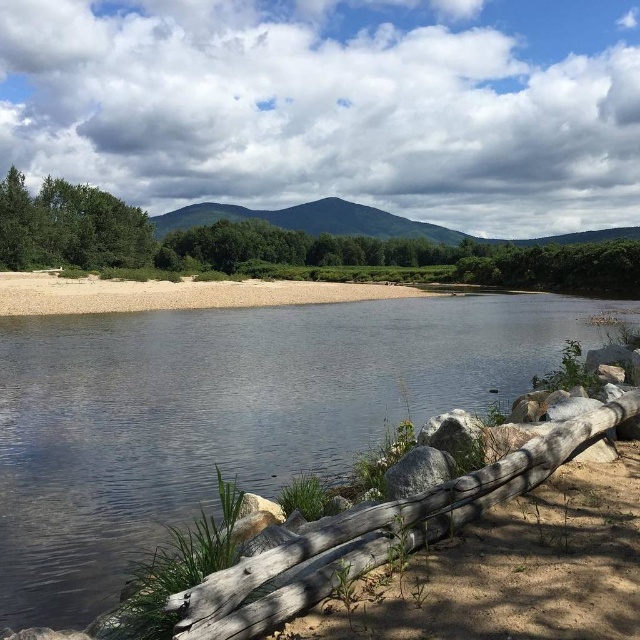
You are standing at the edge of the riverbank in the image and want to reach both the point at coordinates point (147, 376) and the point at coordinates point (504, 248). Which point will you reach first as you walk towards them?

You will reach point (147, 376) first because it is closer to you than point (504, 248).

You are an environmental scientist assessing the scene. You need to determine which area covers more ground between the clear water at center and the green leafy tree at left. Based on the description, which one has a larger area?

The green leafy tree at left has a larger area than the clear water at center because the clear water at center occupies less space than the green leafy tree at left.